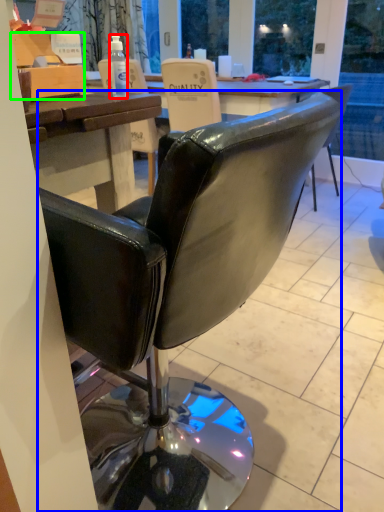
Question: Considering the real-world distances, which object is farthest from bottle (highlighted by a red box)? chair (highlighted by a blue box) or box (highlighted by a green box)?

Choices:
 (A) chair
 (B) box

Answer: (A)